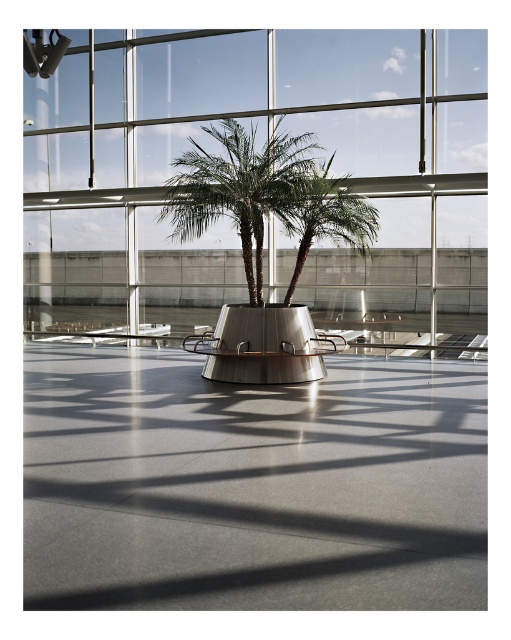
Question: Estimate the real-world distances between objects in this image. Which object is farther from the transparent glass window at center?

Choices:
 (A) green glossy palm tree at center
 (B) green leafy palm tree at center

Answer: (B)

Question: Is transparent glass window at center to the left of green glossy palm tree at center from the viewer's perspective?

Choices:
 (A) yes
 (B) no

Answer: (A)

Question: Does transparent glass window at center have a larger size compared to green glossy palm tree at center?

Choices:
 (A) yes
 (B) no

Answer: (A)

Question: Which of the following is the farthest from the observer?

Choices:
 (A) (339, 196)
 (B) (51, 285)
 (C) (306, 161)

Answer: (B)

Question: Which is nearer to the transparent glass window at center?

Choices:
 (A) green leafy palm tree at center
 (B) green glossy palm tree at center

Answer: (B)

Question: From the image, what is the correct spatial relationship of transparent glass window at center in relation to green leafy palm tree at center?

Choices:
 (A) left
 (B) right

Answer: (A)